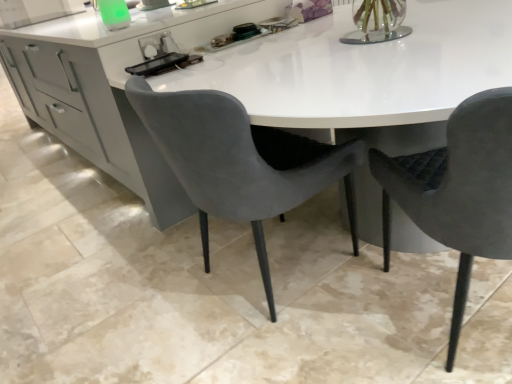
Question: Is velvet grey chair at center, arranged as the 2th chair when viewed from the right, situated inside velvet grey chair at right, marked as the second chair in a left-to-right arrangement, or outside?

Choices:
 (A) outside
 (B) inside

Answer: (A)

Question: Visually, is velvet grey chair at center, the first chair when ordered from left to right, positioned to the left or to the right of velvet grey chair at right, marked as the second chair in a left-to-right arrangement?

Choices:
 (A) left
 (B) right

Answer: (A)

Question: Considering the positions of velvet grey chair at center, arranged as the 2th chair when viewed from the right, and velvet grey chair at right, the first chair from the right, in the image, is velvet grey chair at center, arranged as the 2th chair when viewed from the right, wider or thinner than velvet grey chair at right, the first chair from the right,?

Choices:
 (A) thin
 (B) wide

Answer: (A)

Question: In the image, is velvet grey chair at right, marked as the second chair in a left-to-right arrangement, on the left side or the right side of velvet grey chair at center, the first chair when ordered from left to right?

Choices:
 (A) left
 (B) right

Answer: (B)

Question: Is point (480, 137) closer or farther from the camera than point (266, 281)?

Choices:
 (A) closer
 (B) farther

Answer: (A)

Question: Is velvet grey chair at right, the first chair from the right, inside the boundaries of velvet grey chair at center, the first chair when ordered from left to right, or outside?

Choices:
 (A) outside
 (B) inside

Answer: (A)

Question: Is velvet grey chair at right, the first chair from the right, taller or shorter than velvet grey chair at center, arranged as the 2th chair when viewed from the right?

Choices:
 (A) short
 (B) tall

Answer: (B)